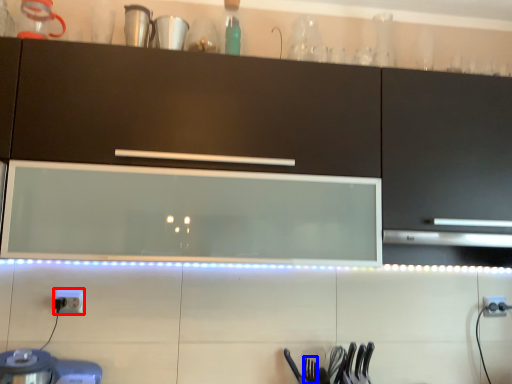
Question: Which point is further to the camera, electric outlet (highlighted by a red box) or silverware (highlighted by a blue box)?

Choices:
 (A) electric outlet
 (B) silverware

Answer: (A)